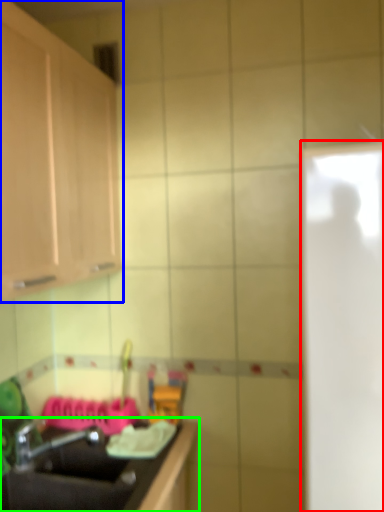
Question: Estimate the real-world distances between objects in this image. Which object is closer to glass door (highlighted by a red box), cabinetry (highlighted by a blue box) or countertop (highlighted by a green box)?

Choices:
 (A) cabinetry
 (B) countertop

Answer: (B)